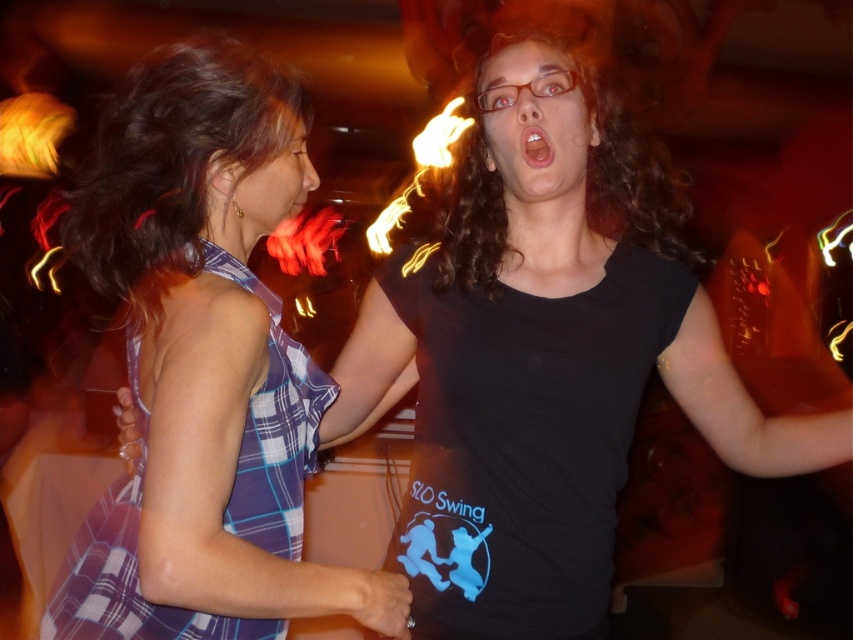
Question: Among these objects, which one is nearest to the camera?

Choices:
 (A) black matte tank top at center
 (B) plaid fabric dress at left

Answer: (B)

Question: Can you confirm if black matte tank top at center is bigger than plaid fabric dress at left?

Choices:
 (A) yes
 (B) no

Answer: (B)

Question: Observing the image, what is the correct spatial positioning of black matte tank top at center in reference to plaid fabric dress at left?

Choices:
 (A) below
 (B) above

Answer: (B)

Question: Can you confirm if black matte tank top at center is bigger than plaid fabric dress at left?

Choices:
 (A) yes
 (B) no

Answer: (B)